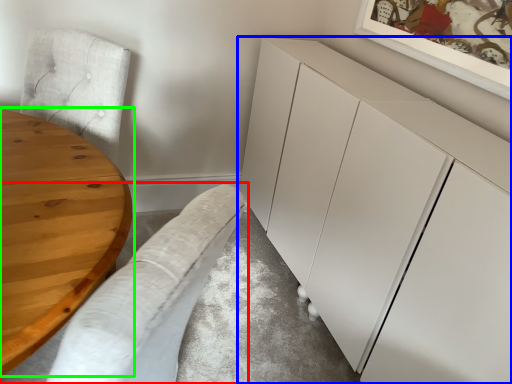
Question: Which object is the farthest from couch (highlighted by a red box)? Choose among these: cabinetry (highlighted by a blue box) or table (highlighted by a green box).

Choices:
 (A) cabinetry
 (B) table

Answer: (A)